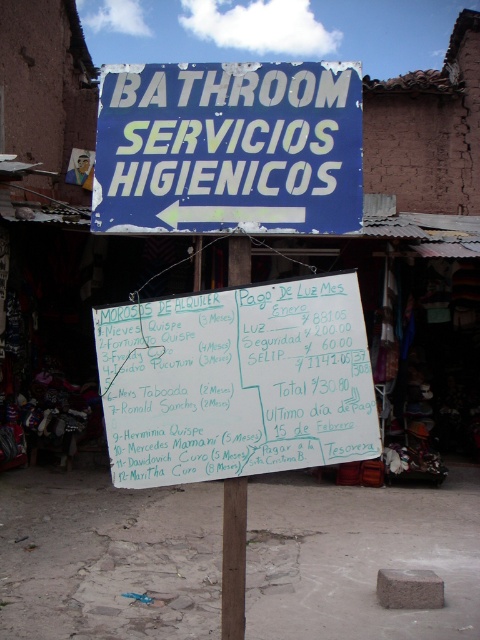
You are a delivery person who needs to place a green paperboard at center on a table that is 3 meters long. Can you fit it without overlapping the edges?

The green paperboard at center is 3.18 meters in length, which is slightly longer than the 3 meter table. Therefore, it cannot be placed without overlapping the edges.

You are at a market and need to find the bathroom rental information. There is a green paperboard at center and a white paper sign at center. Which one is on the right side?

The green paperboard at center is positioned on the right side of the white paper sign at center, so the green paperboard at center is on the right.

From the picture: What is located at the coordinates point (237, 381) in the image?

The point (237, 381) indicates a green paperboard at center.